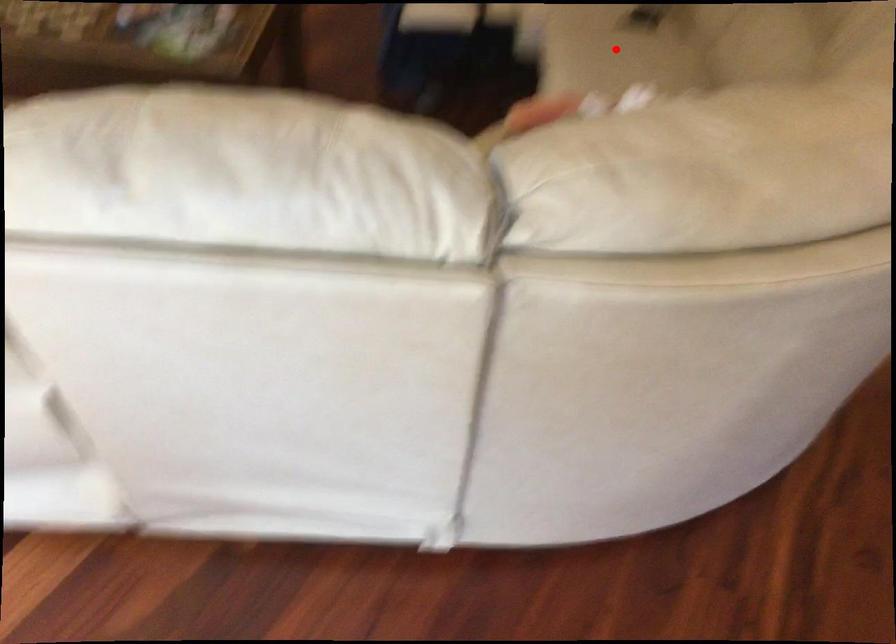
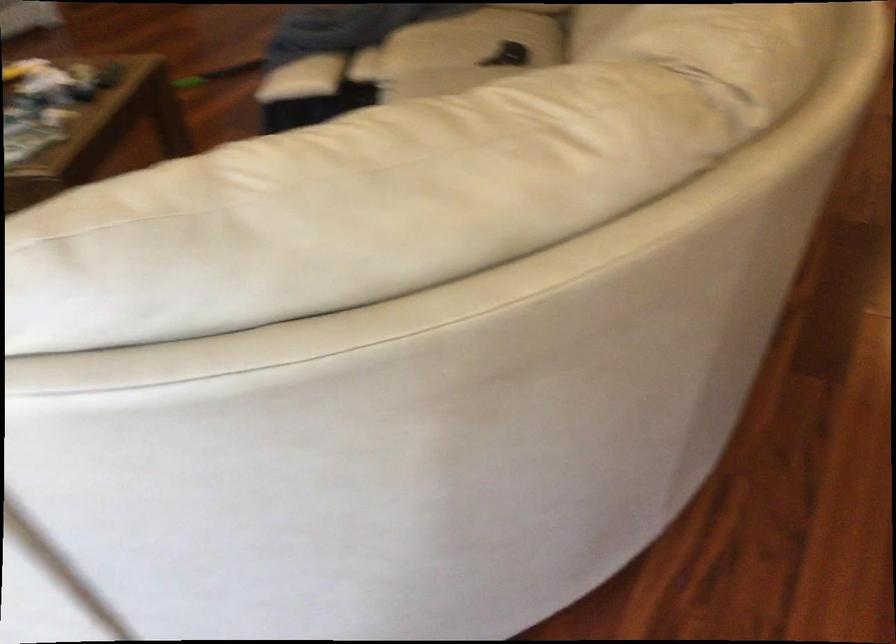
Question: I am providing you with two images of the same scene from different viewpoints. A red point is marked on the first image. At the location where the point appears in image 1, is it still visible in image 2?

Choices:
 (A) Yes
 (B) No

Answer: (B)